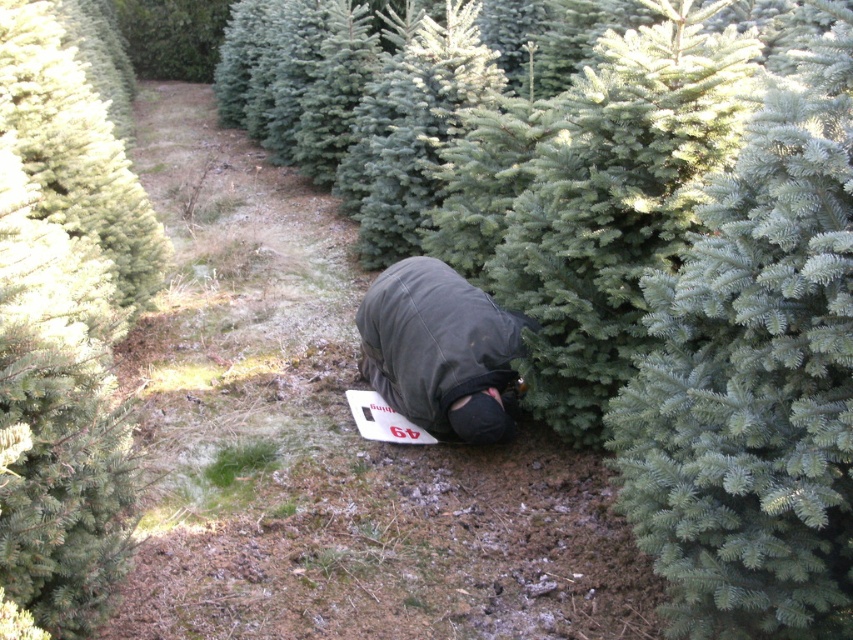
Can you confirm if green matte evergreen tree at center is shorter than dark gray fabric snowboard at center?

In fact, green matte evergreen tree at center may be taller than dark gray fabric snowboard at center.

Where is `green matte evergreen tree at center`? Image resolution: width=853 pixels, height=640 pixels. green matte evergreen tree at center is located at coordinates (64, 323).

I want to click on green matte evergreen tree at center, so click(x=64, y=323).